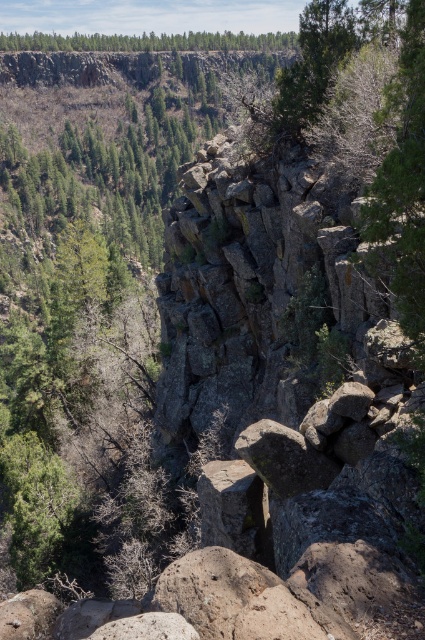
Question: Is green textured tree at upper right in front of green matte forest at upper center?

Choices:
 (A) no
 (B) yes

Answer: (B)

Question: Does green textured tree at upper right appear on the right side of green matte forest at upper center?

Choices:
 (A) yes
 (B) no

Answer: (A)

Question: Which point is closer to the camera?

Choices:
 (A) green matte forest at upper center
 (B) green textured tree at upper right

Answer: (B)

Question: Is green textured tree at upper right thinner than green matte forest at upper center?

Choices:
 (A) yes
 (B) no

Answer: (A)